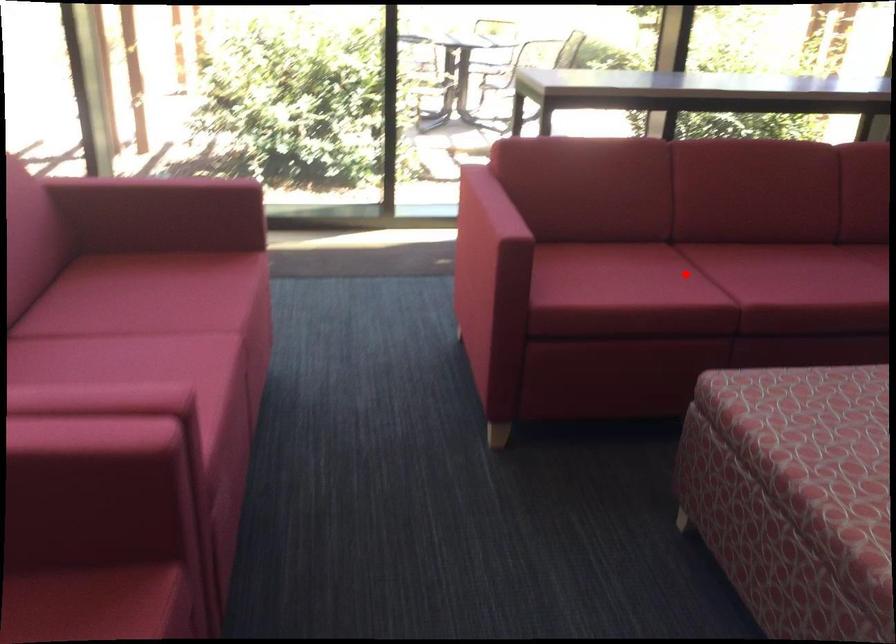
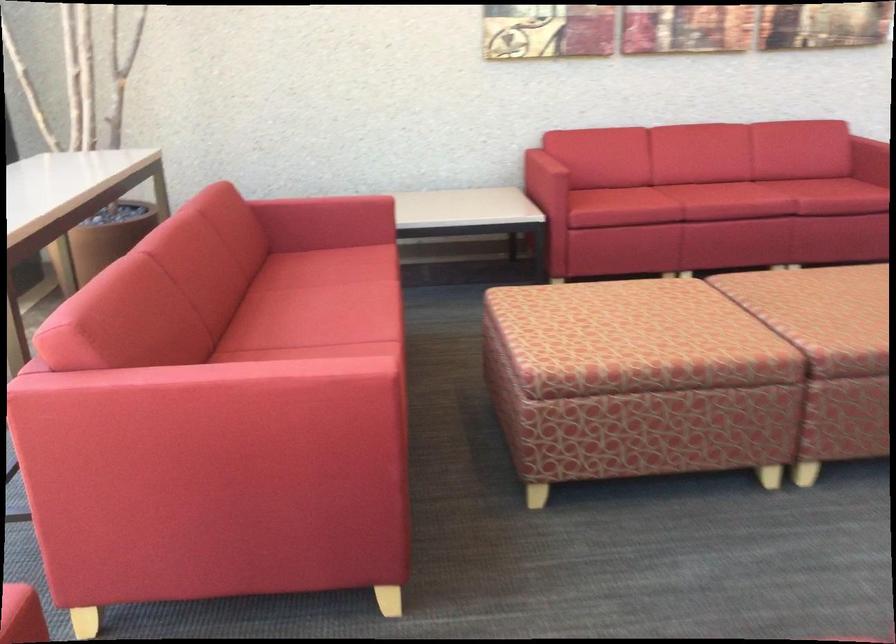
Find the pixel in the second image that matches the highlighted location in the first image.

(319, 355)